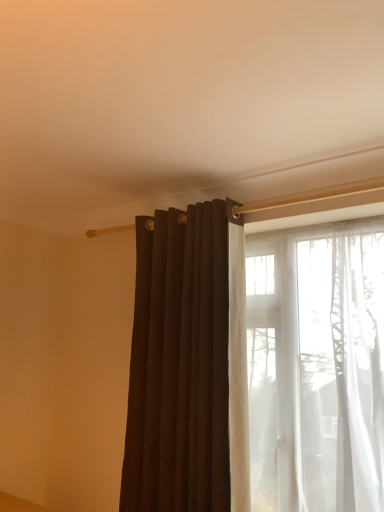
Question: Which is correct: matte dark brown curtain at center is inside translucent white curtain at right, or outside of it?

Choices:
 (A) inside
 (B) outside

Answer: (B)

Question: Is matte dark brown curtain at center taller or shorter than translucent white curtain at right?

Choices:
 (A) tall
 (B) short

Answer: (A)

Question: Considering the relative positions of matte dark brown curtain at center and translucent white curtain at right in the image provided, is matte dark brown curtain at center to the left or to the right of translucent white curtain at right?

Choices:
 (A) left
 (B) right

Answer: (A)

Question: Is point (240, 279) closer or farther from the camera than point (122, 478)?

Choices:
 (A) farther
 (B) closer

Answer: (B)

Question: In the image, is translucent white curtain at right on the left side or the right side of matte dark brown curtain at center?

Choices:
 (A) left
 (B) right

Answer: (B)

Question: Is translucent white curtain at right bigger or smaller than matte dark brown curtain at center?

Choices:
 (A) big
 (B) small

Answer: (A)

Question: From the image's perspective, relative to matte dark brown curtain at center, is translucent white curtain at right above or below?

Choices:
 (A) below
 (B) above

Answer: (A)